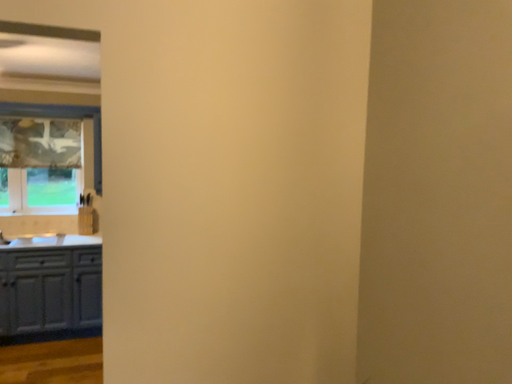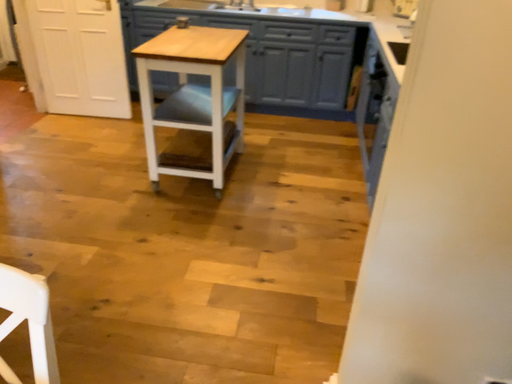
Question: How did the camera likely rotate when shooting the video?

Choices:
 (A) rotated upward
 (B) rotated downward

Answer: (B)